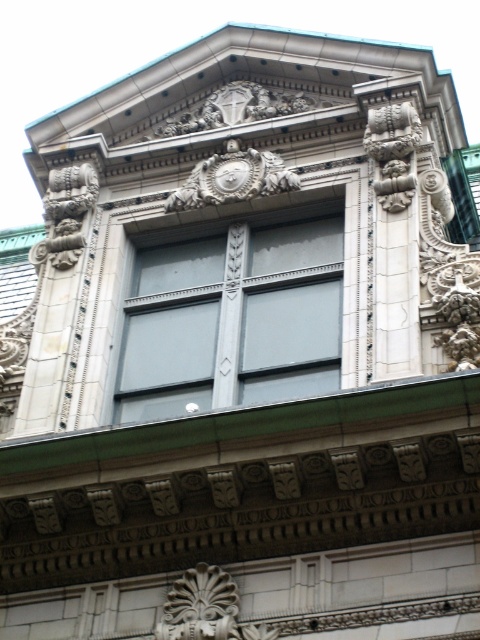
Question: Which point is closer to the camera taking this photo?

Choices:
 (A) (124, 358)
 (B) (208, 634)

Answer: (B)

Question: Which object appears farthest from the camera in this image?

Choices:
 (A) carved stone ornament at center
 (B) matte gray glass window at center

Answer: (B)

Question: Among these objects, which one is nearest to the camera?

Choices:
 (A) matte gray glass window at center
 (B) carved stone ornament at center

Answer: (B)

Question: Can you confirm if matte gray glass window at center is smaller than carved stone ornament at center?

Choices:
 (A) yes
 (B) no

Answer: (B)

Question: Is matte gray glass window at center below carved stone ornament at center?

Choices:
 (A) yes
 (B) no

Answer: (B)

Question: Does matte gray glass window at center have a smaller size compared to carved stone ornament at center?

Choices:
 (A) yes
 (B) no

Answer: (B)